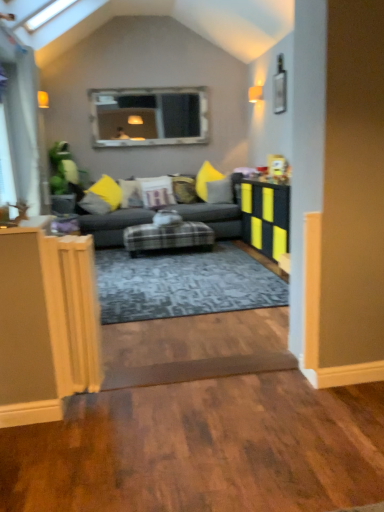
Question: Can you confirm if matte black table at right is taller than plush gray couch at center?

Choices:
 (A) yes
 (B) no

Answer: (B)

Question: Is the surface of matte black table at right in direct contact with plush gray couch at center?

Choices:
 (A) no
 (B) yes

Answer: (A)

Question: Is matte black table at right bigger than plush gray couch at center?

Choices:
 (A) yes
 (B) no

Answer: (B)

Question: From a real-world perspective, is matte black table at right on top of plush gray couch at center?

Choices:
 (A) no
 (B) yes

Answer: (B)

Question: From the image's perspective, is matte black table at right below plush gray couch at center?

Choices:
 (A) yes
 (B) no

Answer: (A)

Question: Based on their positions, is plaid fabric ottoman at center located to the left or right of velvet yellow pillow at center, the 4th pillow viewed from the left?

Choices:
 (A) right
 (B) left

Answer: (B)

Question: Relative to velvet yellow pillow at center, the 4th pillow viewed from the left, is plaid fabric ottoman at center in front or behind?

Choices:
 (A) front
 (B) behind

Answer: (A)

Question: Considering the positions of plaid fabric ottoman at center and velvet yellow pillow at center, positioned as the second pillow in right-to-left order, in the image, is plaid fabric ottoman at center bigger or smaller than velvet yellow pillow at center, positioned as the second pillow in right-to-left order,?

Choices:
 (A) small
 (B) big

Answer: (B)

Question: Looking at their shapes, would you say plaid fabric ottoman at center is wider or thinner than velvet yellow pillow at center, positioned as the second pillow in right-to-left order?

Choices:
 (A) thin
 (B) wide

Answer: (B)

Question: From their relative heights in the image, would you say brown wood plank at lower center is taller or shorter than clear glass window at upper center?

Choices:
 (A) short
 (B) tall

Answer: (A)

Question: Considering the positions of point (168, 379) and point (117, 94), is point (168, 379) closer or farther from the camera than point (117, 94)?

Choices:
 (A) closer
 (B) farther

Answer: (A)

Question: In the image, is brown wood plank at lower center on the left side or the right side of clear glass window at upper center?

Choices:
 (A) left
 (B) right

Answer: (B)

Question: From the image's perspective, relative to clear glass window at upper center, is brown wood plank at lower center above or below?

Choices:
 (A) below
 (B) above

Answer: (A)

Question: In the image, is plush gray couch at center positioned in front of or behind matte black table at right?

Choices:
 (A) front
 (B) behind

Answer: (B)

Question: Do you think plush gray couch at center is within matte black table at right, or outside of it?

Choices:
 (A) outside
 (B) inside

Answer: (A)